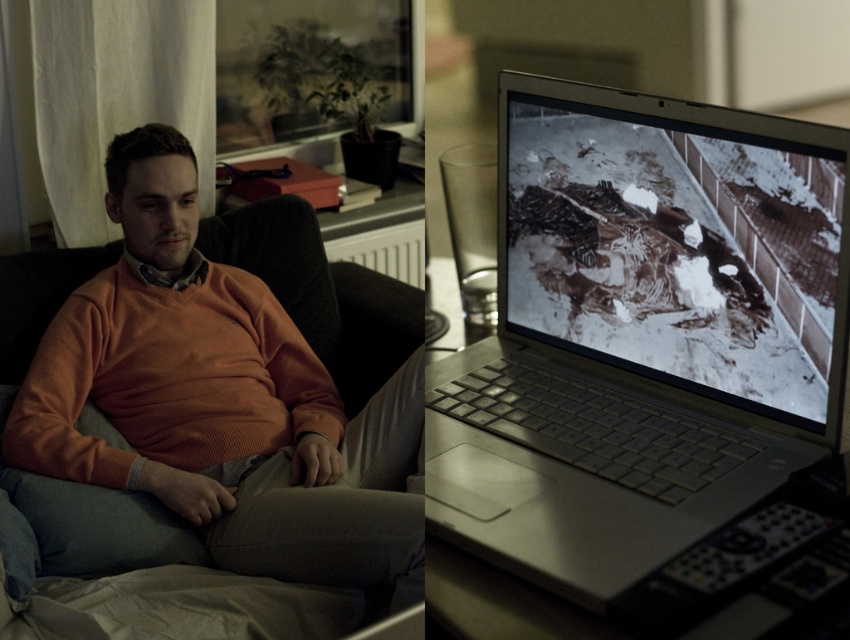
You are organizing a small desk space and need to place both the silver metallic laptop at center and the orange knitted sweater at center. Since the desk has limited width, which object should you place first to ensure both fit?

The silver metallic laptop at center has a smaller width than the orange knitted sweater at center, so you should place the orange knitted sweater at center first to accommodate its larger size and then fit the silver metallic laptop at center next to it.

You are organizing a study space and need to place both the silver metallic laptop at center and the orange knitted sweater at center on a shelf. Which object should you place first to ensure both fit on the shelf?

You should place the silver metallic laptop at center first because it occupies less space than the orange knitted sweater at center, allowing more room for the sweater afterward.

You are a delivery person who needs to place a package on the table between the silver metallic laptop at center and the orange knitted sweater at center. The package is 23 inches long. Will it fit between them?

The silver metallic laptop at center is 22.73 inches away from the orange knitted sweater at center. The package is 23 inches long, so it will not fit between them because the distance is slightly less than the package length.